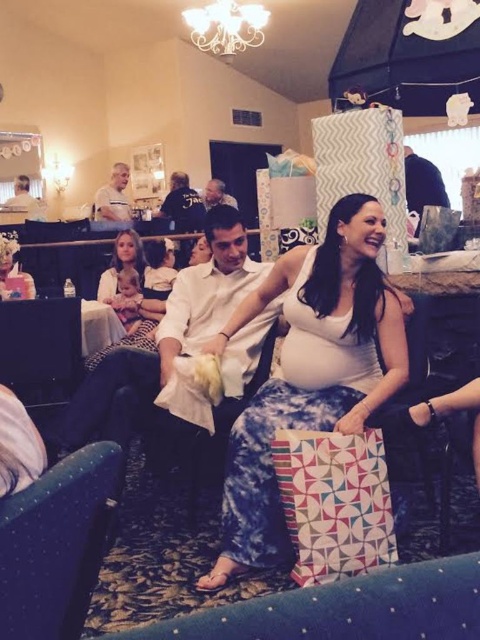
You are a photographer at the baby shower and want to capture a photo of the matte white belly at center and the white matte shirt at upper left. Which object is located lower in the frame?

The matte white belly at center is positioned under the white matte shirt at upper left, so it is lower in the frame.

You are at the point labeled point (182, 218) and want to move to the pregnant woman on the couch. Is the point labeled point (273, 488) blocking your path?

Point (273, 488) is in front of point (182, 218), so yes, the point labeled point (273, 488) is blocking your path to the pregnant woman on the couch.

Looking at this image, you are at a baby shower and see the matte white belly at center and the white matte shirt at upper left. Which one is positioned to the right side of the other?

The matte white belly at center is positioned to the right of the white matte shirt at upper left.